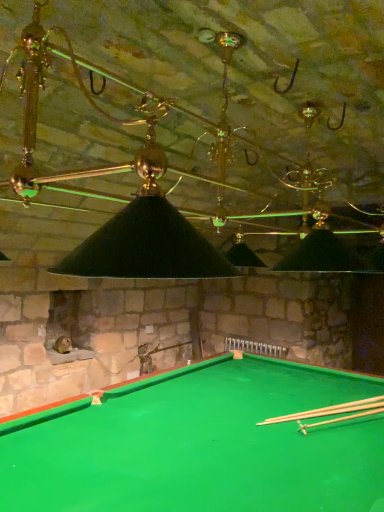
Question: Based on their sizes in the image, would you say light brown wooden cue at bottom right is bigger or smaller than green felt billiard table at lower center?

Choices:
 (A) big
 (B) small

Answer: (B)

Question: Choose the correct answer: Is light brown wooden cue at bottom right inside green felt billiard table at lower center or outside it?

Choices:
 (A) outside
 (B) inside

Answer: (B)

Question: Considering the positions of point (276, 422) and point (367, 499), is point (276, 422) closer or farther from the camera than point (367, 499)?

Choices:
 (A) closer
 (B) farther

Answer: (B)

Question: Is green felt billiard table at lower center wider or thinner than light brown wooden cue at bottom right?

Choices:
 (A) wide
 (B) thin

Answer: (A)

Question: From the image's perspective, relative to light brown wooden cue at bottom right, is green felt billiard table at lower center above or below?

Choices:
 (A) above
 (B) below

Answer: (B)

Question: In terms of height, does green felt billiard table at lower center look taller or shorter compared to light brown wooden cue at bottom right?

Choices:
 (A) tall
 (B) short

Answer: (A)

Question: Is green felt billiard table at lower center inside or outside of light brown wooden cue at bottom right?

Choices:
 (A) outside
 (B) inside

Answer: (A)